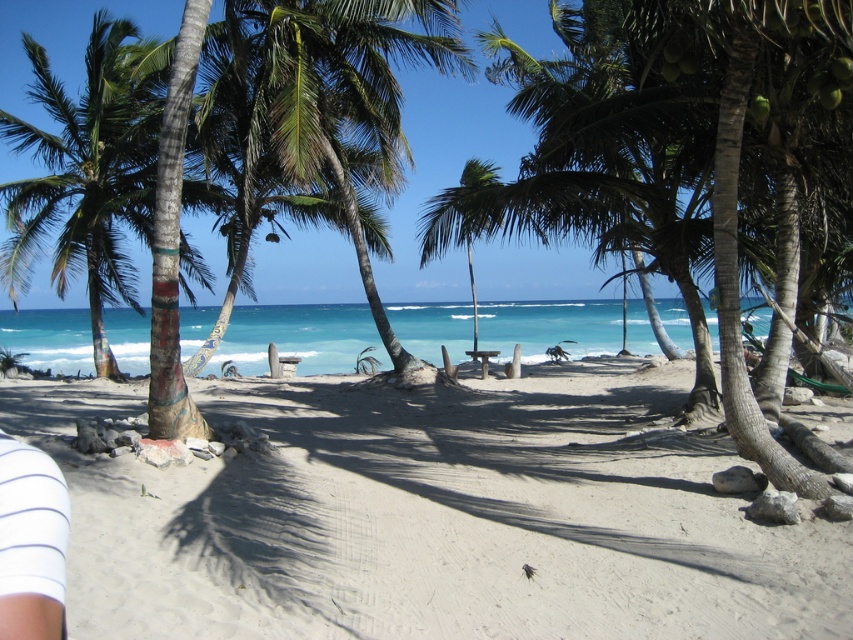
Question: Is white sandy beach at center thinner than white striped leg at lower left?

Choices:
 (A) no
 (B) yes

Answer: (A)

Question: Which object is closer to the camera taking this photo?

Choices:
 (A) green leafy palm tree at center
 (B) white striped leg at lower left

Answer: (B)

Question: Estimate the real-world distances between objects in this image. Which object is closer to the green leafy palm tree at center?

Choices:
 (A) white sandy beach at center
 (B) white striped leg at lower left

Answer: (A)

Question: Is white sandy beach at center in front of white striped leg at lower left?

Choices:
 (A) no
 (B) yes

Answer: (A)

Question: Is white sandy beach at center wider than green leafy palm tree at center?

Choices:
 (A) yes
 (B) no

Answer: (A)

Question: Which is farther from the green leafy palm tree at center?

Choices:
 (A) white striped leg at lower left
 (B) white sandy beach at center

Answer: (A)